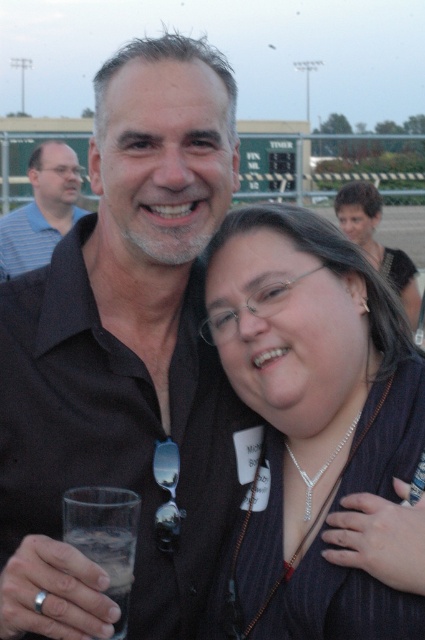
Question: Can you confirm if matte black hair at upper right is thinner than clear glass at lower left?

Choices:
 (A) no
 (B) yes

Answer: (A)

Question: Does black shirt at center appear over silver metallic necklace at center?

Choices:
 (A) no
 (B) yes

Answer: (B)

Question: Estimate the real-world distances between objects in this image. Which object is closer to the clear glass at lower left?

Choices:
 (A) silver metallic necklace at center
 (B) black shirt at center

Answer: (B)

Question: Which is farther from the black shirt at center?

Choices:
 (A) clear glass at lower left
 (B) matte black hair at upper right
 (C) matte blue shirt at left

Answer: (C)

Question: Which point is closer to the camera taking this photo?

Choices:
 (A) (311, 307)
 (B) (393, 259)

Answer: (A)

Question: Does clear glass at lower left appear under silver metallic necklace at center?

Choices:
 (A) yes
 (B) no

Answer: (A)